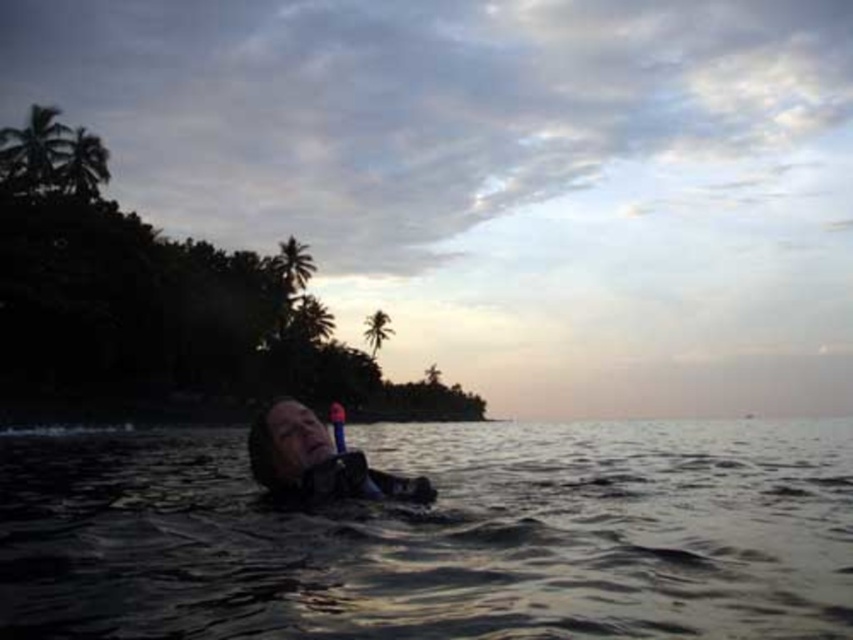
Question: Is dark matte water at center in front of matte black wetsuit at center?

Choices:
 (A) yes
 (B) no

Answer: (A)

Question: Among these points, which one is farthest from the camera?

Choices:
 (A) (279, 420)
 (B) (149, 492)

Answer: (B)

Question: Among these objects, which one is nearest to the camera?

Choices:
 (A) matte black wetsuit at center
 (B) dark matte water at center

Answer: (B)

Question: Is dark matte water at center to the right of matte black wetsuit at center from the viewer's perspective?

Choices:
 (A) yes
 (B) no

Answer: (A)

Question: Is dark matte water at center smaller than matte black wetsuit at center?

Choices:
 (A) no
 (B) yes

Answer: (A)